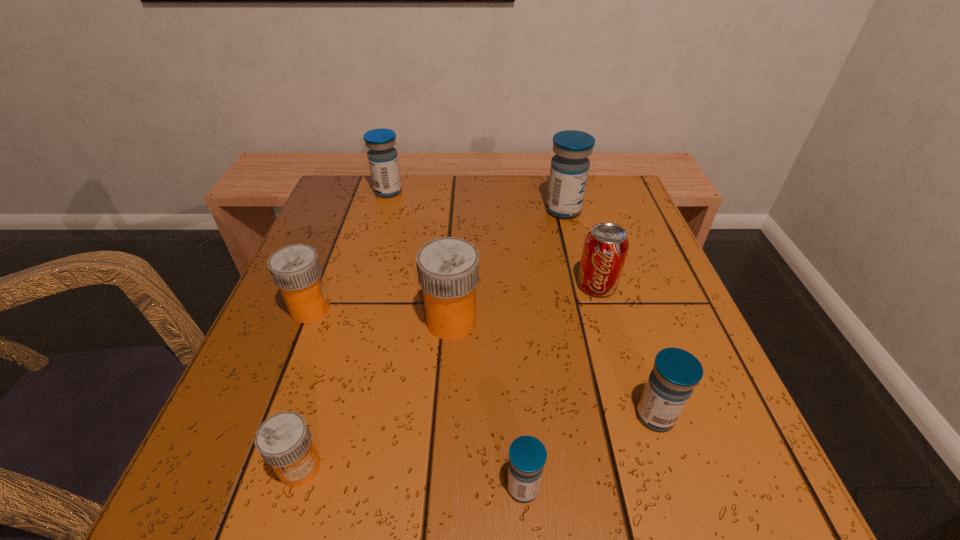
You are a GUI agent. You are given a task and a screenshot of the screen. Output one action in this format:
    pyautogui.click(x=<x>, y=<y>)
    Task: Click on the vacant space situated on the back of the third biggest blue medicine
    
    Given the screenshot: What is the action you would take?
    pyautogui.click(x=600, y=247)

At what (x,y) coordinates should I click in order to perform the action: click on free space located on the back of the third medicine from right to left. Please return your answer as a coordinate pair (x, y). Looking at the image, I should click on (517, 404).

Locate an element on the screen. The image size is (960, 540). soda can that is at the right edge is located at coordinates (605, 248).

Where is `object located in the far left corner section of the desktop`? object located in the far left corner section of the desktop is located at coordinates (383, 161).

Find the location of a particular element. The width and height of the screenshot is (960, 540). object located at the near left corner is located at coordinates (283, 440).

You are a GUI agent. You are given a task and a screenshot of the screen. Output one action in this format:
    pyautogui.click(x=<x>, y=<y>)
    Task: Click on the object at the far right corner
    
    Given the screenshot: What is the action you would take?
    pyautogui.click(x=569, y=169)

Identify the location of free region at the far edge of the desktop. (540, 174).

Locate an element on the screen. The height and width of the screenshot is (540, 960). vacant space at the near edge of the desktop is located at coordinates (355, 464).

Image resolution: width=960 pixels, height=540 pixels. I want to click on free region at the left edge, so click(380, 238).

Find the location of a particular element. This screenshot has width=960, height=540. vacant region at the far left corner of the desktop is located at coordinates (356, 205).